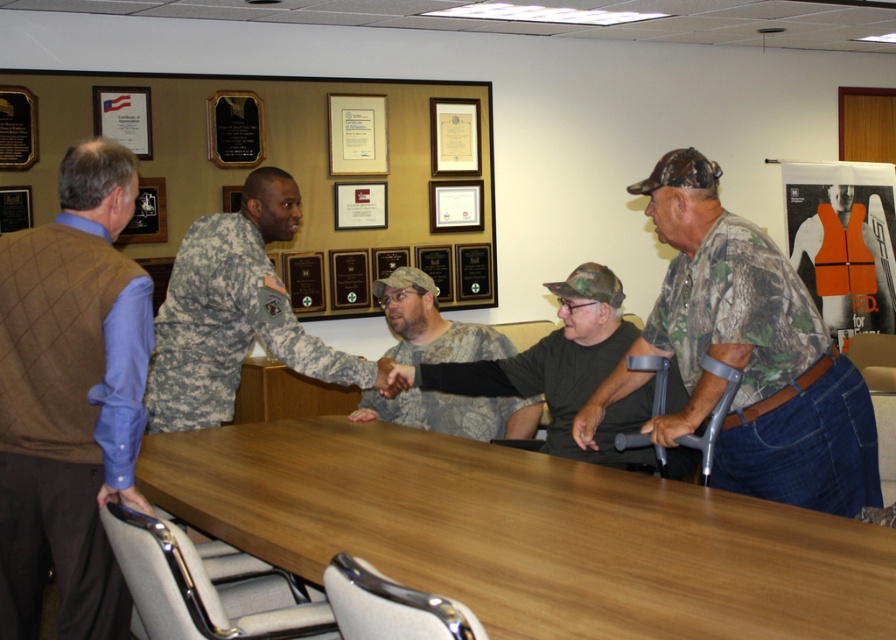
Between camouflage fabric uniform at center and camouflage uniform at center, which one has less height?

camouflage uniform at center is shorter.

Who is positioned more to the left, camouflage fabric uniform at center or camouflage uniform at center?

camouflage fabric uniform at center

Which is behind, point (277, 333) or point (481, 435)?

Positioned behind is point (481, 435).

In order to click on camouflage fabric uniform at center in this screenshot , I will do `click(227, 326)`.

Can you confirm if camouflage fabric uniform at center is positioned to the right of camouflage fabric shirt at center?

Incorrect, camouflage fabric uniform at center is not on the right side of camouflage fabric shirt at center.

Can you confirm if camouflage fabric uniform at center is thinner than camouflage fabric shirt at center?

Yes, camouflage fabric uniform at center is thinner than camouflage fabric shirt at center.

Between point (342, 353) and point (505, 376), which one is positioned in front?

Point (342, 353)

Where is `camouflage fabric uniform at center`? The height and width of the screenshot is (640, 896). camouflage fabric uniform at center is located at coordinates (227, 326).

Between camouflage shirt at right and camouflage fabric shirt at center, which one has more height?

Standing taller between the two is camouflage shirt at right.

Locate an element on the screen. The image size is (896, 640). camouflage shirt at right is located at coordinates (754, 353).